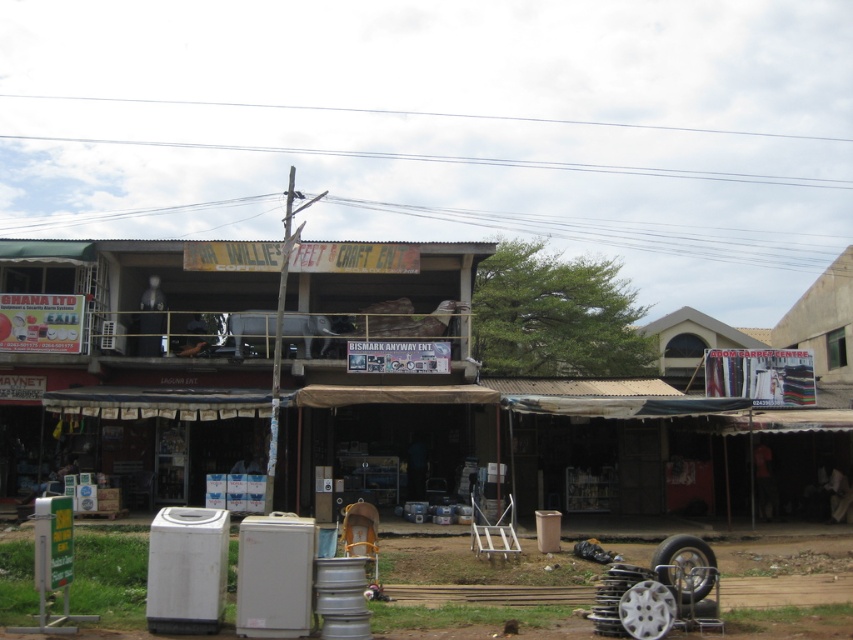
Question: Estimate the real-world distances between objects in this image. Which object is closer to the striped fabric tent at right?

Choices:
 (A) silver metallic tire at lower center
 (B) brown corrugated metal hut at center

Answer: (B)

Question: Which point is farther to the camera?

Choices:
 (A) brown corrugated metal hut at center
 (B) silver metallic tire at lower center
 (C) striped fabric tent at right
 (D) black rubber tire at lower right

Answer: (C)

Question: Which of these objects is positioned farthest from the brown corrugated metal hut at center?

Choices:
 (A) black rubber tire at lower right
 (B) silver metallic tire at lower center
 (C) striped fabric tent at right

Answer: (A)

Question: Is striped fabric tent at right smaller than black rubber tire at lower right?

Choices:
 (A) no
 (B) yes

Answer: (A)

Question: Is striped fabric tent at right positioned behind silver metallic tire at lower center?

Choices:
 (A) no
 (B) yes

Answer: (B)

Question: Considering the relative positions of brown corrugated metal hut at center and silver metallic tire at lower center in the image provided, where is brown corrugated metal hut at center located with respect to silver metallic tire at lower center?

Choices:
 (A) below
 (B) above

Answer: (B)